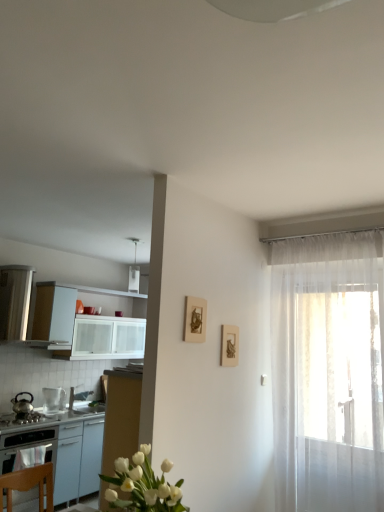
Question: Which direction should I rotate to face matte gold picture frame at upper center, the second picture frame from the back, — up or down?

Choices:
 (A) up
 (B) down

Answer: (B)

Question: Does translucent white curtain at right have a smaller size compared to matte gold picture frame at upper center, arranged as the 2th picture frame when viewed from the right?

Choices:
 (A) no
 (B) yes

Answer: (A)

Question: Is translucent white curtain at right at the right side of matte gold picture frame at upper center, arranged as the first picture frame when viewed from the left?

Choices:
 (A) yes
 (B) no

Answer: (A)

Question: Is the depth of translucent white curtain at right less than that of matte gold picture frame at upper center, which is the 1th picture frame in front-to-back order?

Choices:
 (A) yes
 (B) no

Answer: (B)

Question: Is the position of translucent white curtain at right more distant than that of matte gold picture frame at upper center, arranged as the 2th picture frame when viewed from the right?

Choices:
 (A) no
 (B) yes

Answer: (B)

Question: Does translucent white curtain at right have a greater height compared to matte gold picture frame at upper center, arranged as the first picture frame when viewed from the left?

Choices:
 (A) no
 (B) yes

Answer: (B)

Question: Considering the relative positions of translucent white curtain at right and matte gold picture frame at upper center, arranged as the first picture frame when viewed from the left, in the image provided, is translucent white curtain at right to the left of matte gold picture frame at upper center, arranged as the first picture frame when viewed from the left, from the viewer's perspective?

Choices:
 (A) yes
 (B) no

Answer: (B)

Question: Can you confirm if clear glass pitcher at left, the 1th kitchen appliance when ordered from right to left, is taller than white glossy table at left?

Choices:
 (A) no
 (B) yes

Answer: (A)

Question: Is the position of clear glass pitcher at left, which appears as the 2th kitchen appliance when viewed from the left, more distant than that of white glossy table at left?

Choices:
 (A) yes
 (B) no

Answer: (A)

Question: Is clear glass pitcher at left, the 1th kitchen appliance when ordered from right to left, bigger than white glossy table at left?

Choices:
 (A) no
 (B) yes

Answer: (A)

Question: Does clear glass pitcher at left, which appears as the 2th kitchen appliance when viewed from the left, have a lesser height compared to white glossy table at left?

Choices:
 (A) no
 (B) yes

Answer: (B)

Question: Is clear glass pitcher at left, the 1th kitchen appliance when ordered from right to left, to the left of white glossy table at left from the viewer's perspective?

Choices:
 (A) no
 (B) yes

Answer: (B)

Question: Would you say clear glass pitcher at left, which appears as the 2th kitchen appliance when viewed from the left, is outside white glossy table at left?

Choices:
 (A) yes
 (B) no

Answer: (A)

Question: Does white glossy sink at lower left have a larger size compared to white glossy table at left?

Choices:
 (A) no
 (B) yes

Answer: (A)